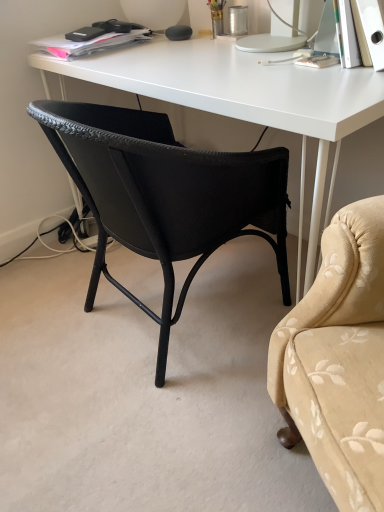
Find the location of a particular element. white matte desk at center is located at coordinates (242, 97).

Based on the photo, do you think black woven chair at center is within matte black charger at upper left, or outside of it?

black woven chair at center lies outside matte black charger at upper left.

Can you confirm if black woven chair at center is taller than matte black charger at upper left?

Correct, black woven chair at center is much taller as matte black charger at upper left.

Which of these two, black woven chair at center or matte black charger at upper left, is thinner?

matte black charger at upper left.

What are the coordinates of `chair in front of the matte black charger at upper left` in the screenshot? It's located at (164, 195).

Where is `book located above the white matte desk at center (from a real-world perspective)`? book located above the white matte desk at center (from a real-world perspective) is located at coordinates tap(93, 39).

How different are the orientations of white matte desk at center and matte black charger at upper left in degrees?

1.75 degrees.

Which of these two, white matte desk at center or matte black charger at upper left, stands taller?

white matte desk at center.

Could you tell me if white matte desk at center is turned towards matte black charger at upper left?

No, white matte desk at center is not turned towards matte black charger at upper left.

How many degrees apart are the facing directions of matte black charger at upper left and white matte desk at center?

Result: They differ by 1.75 degrees in their facing directions.

In the image, is matte black charger at upper left positioned in front of or behind white matte desk at center?

matte black charger at upper left is positioned farther from the viewer than white matte desk at center.

Considering the relative positions of matte black charger at upper left and white matte desk at center in the image provided, is matte black charger at upper left to the right of white matte desk at center from the viewer's perspective?

No.

Is matte black charger at upper left aimed at white matte desk at center?

No, matte black charger at upper left does not turn towards white matte desk at center.

Looking at the image, does white matte desk at center seem bigger or smaller compared to black woven chair at center?

In the image, white matte desk at center appears to be larger than black woven chair at center.

Which of these two, white matte desk at center or black woven chair at center, stands taller?

white matte desk at center is taller.

From the image's perspective, is white matte desk at center located above or below black woven chair at center?

Clearly, from the image's perspective, white matte desk at center is above black woven chair at center.

Is point (306, 285) closer to camera compared to point (166, 343)?

Yes, point (306, 285) is in front of point (166, 343).

Identify the location of book located behind the black woven chair at center. (93, 39).

Considering the positions of point (137, 29) and point (194, 188), is point (137, 29) closer or farther from the camera than point (194, 188)?

Point (137, 29) appears to be farther away from the viewer than point (194, 188).

Relative to black woven chair at center, is matte black charger at upper left in front or behind?

Visually, matte black charger at upper left is located behind black woven chair at center.

Considering the sizes of objects matte black charger at upper left and black woven chair at center in the image provided, who is taller, matte black charger at upper left or black woven chair at center?

With more height is black woven chair at center.

Looking at this image, which object is more forward, black woven chair at center or white matte desk at center?

black woven chair at center is in front.

From a real-world perspective, is black woven chair at center above or below white matte desk at center?

Clearly, from a real-world perspective, black woven chair at center is below white matte desk at center.

Which is behind, point (102, 256) or point (217, 90)?

The point (102, 256) is farther.

Between black woven chair at center and white matte desk at center, which one appears on the left side from the viewer's perspective?

black woven chair at center.

Locate an element on the screen. The image size is (384, 512). book that appears above the black woven chair at center (from a real-world perspective) is located at coordinates (93, 39).

This screenshot has width=384, height=512. Identify the location of book behind the white matte desk at center. (93, 39).

Estimate the real-world distances between objects in this image. Which object is further from matte black charger at upper left, white matte desk at center or black woven chair at center?

The object further to matte black charger at upper left is black woven chair at center.

Which object lies further to the anchor point white matte desk at center, black woven chair at center or matte black charger at upper left?

Based on the image, matte black charger at upper left appears to be further to white matte desk at center.

In the scene shown: Considering their positions, is black woven chair at center positioned further to matte black charger at upper left than white matte desk at center?

black woven chair at center.

Which object lies further to the anchor point black woven chair at center, matte black charger at upper left or white matte desk at center?

matte black charger at upper left is further to black woven chair at center.

When comparing their distances from black woven chair at center, does white matte desk at center or matte black charger at upper left seem further?

Based on the image, matte black charger at upper left appears to be further to black woven chair at center.

From the image, which object appears to be farther from white matte desk at center, matte black charger at upper left or black woven chair at center?

matte black charger at upper left is further to white matte desk at center.

Where is `desk positioned between black woven chair at center and matte black charger at upper left from near to far`? The width and height of the screenshot is (384, 512). desk positioned between black woven chair at center and matte black charger at upper left from near to far is located at coordinates (242, 97).